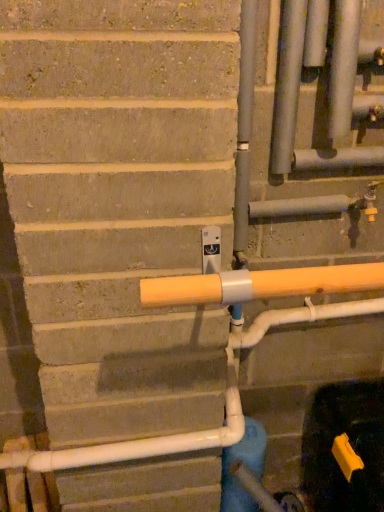
Question: Relative to satin silver pipes at upper right, marked as the second pipe in a right-to-left arrangement, is blue matte water pipe at lower center in front or behind?

Choices:
 (A) front
 (B) behind

Answer: (B)

Question: Is blue matte water pipe at lower center inside the boundaries of satin silver pipes at upper right, marked as the second pipe in a right-to-left arrangement, or outside?

Choices:
 (A) inside
 (B) outside

Answer: (B)

Question: Estimate the real-world distances between objects in this image. Which object is farther from the blue matte water pipe at lower center?

Choices:
 (A) matte silver pipe at upper right, arranged as the 1th pipe when viewed from the right
 (B) satin silver pipes at upper right, marked as the second pipe in a right-to-left arrangement

Answer: (A)

Question: Which of these objects is positioned closest to the satin silver pipes at upper right, placed as the 1th pipe when sorted from left to right?

Choices:
 (A) blue matte water pipe at lower center
 (B) matte silver pipe at upper right, the 2th pipe when ordered from left to right

Answer: (B)